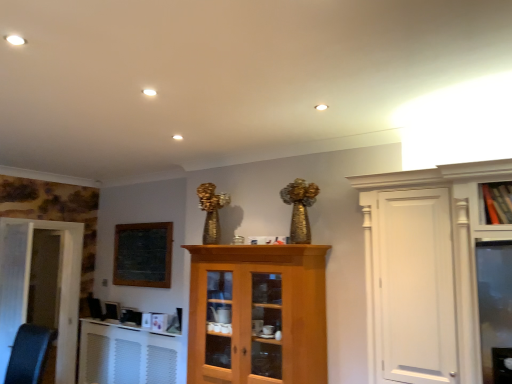
Question: Based on their sizes in the image, would you say white textured radiator at lower left is bigger or smaller than wooden cabinet at upper right?

Choices:
 (A) big
 (B) small

Answer: (A)

Question: From their relative heights in the image, would you say white textured radiator at lower left is taller or shorter than wooden cabinet at upper right?

Choices:
 (A) tall
 (B) short

Answer: (A)

Question: Which is farther from the black leather swivel chair at lower left?

Choices:
 (A) white textured radiator at lower left
 (B) wooden cabinet at center
 (C) white matte door at left, marked as the second door in a back-to-front arrangement
 (D) white glossy door at left, which appears as the first door when viewed from the back
 (E) wooden cabinet at upper right

Answer: (E)

Question: Estimate the real-world distances between objects in this image. Which object is closer to the wooden cabinet at center?

Choices:
 (A) white glossy door at left, which appears as the first door when viewed from the back
 (B) white textured radiator at lower left
 (C) black leather swivel chair at lower left
 (D) wooden cabinet at upper right
 (E) white matte door at left, marked as the second door in a back-to-front arrangement

Answer: (B)